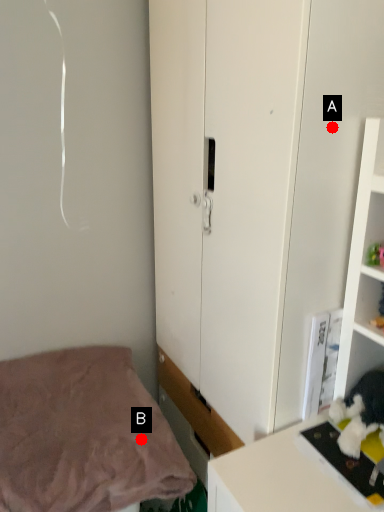
Question: Two points are circled on the image, labeled by A and B beside each circle. Which of the following is the closest to the observer?

Choices:
 (A) A is closer
 (B) B is closer

Answer: (A)